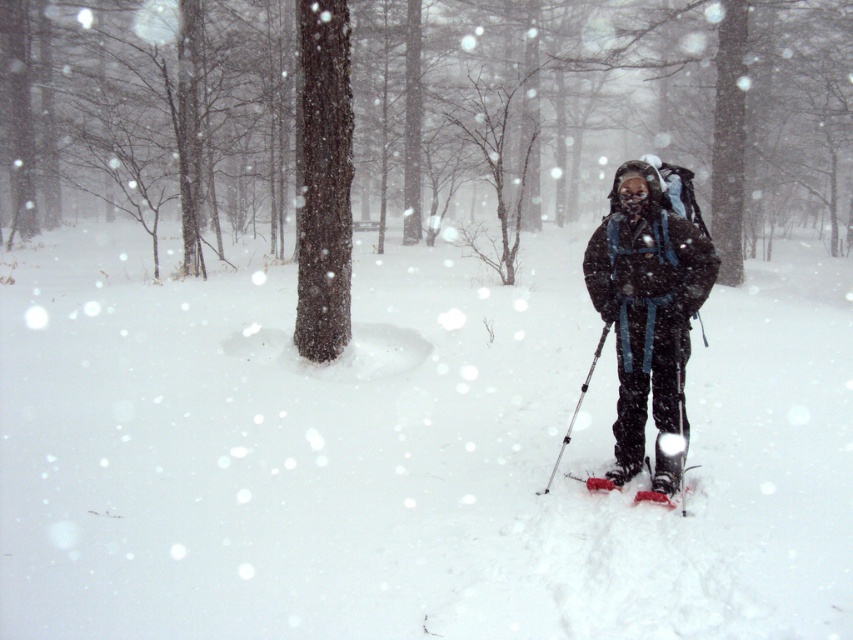
Is smooth dark brown tree trunk at center thinner than metallic silver ski pole at center?

Indeed, smooth dark brown tree trunk at center has a lesser width compared to metallic silver ski pole at center.

Does smooth dark brown tree trunk at center have a greater height compared to metallic silver ski pole at center?

Indeed, smooth dark brown tree trunk at center has a greater height compared to metallic silver ski pole at center.

You are a GUI agent. You are given a task and a screenshot of the screen. Output one action in this format:
    pyautogui.click(x=<x>, y=<y>)
    Task: Click on the smooth dark brown tree trunk at center
    Image resolution: width=853 pixels, height=640 pixels.
    Given the screenshot: What is the action you would take?
    pyautogui.click(x=323, y=179)

Does matte black jacket at center lie behind metallic silver ski pole at center?

No.

Between matte black jacket at center and metallic silver ski pole at center, which one is positioned lower?

metallic silver ski pole at center

At what (x,y) coordinates should I click in order to perform the action: click on matte black jacket at center. Please return your answer as a coordinate pair (x, y). Looking at the image, I should click on point(648,308).

Is white fluffy snow at center bigger than red plastic ski at center?

Yes.

From the picture: Which is below, white fluffy snow at center or red plastic ski at center?

red plastic ski at center

The image size is (853, 640). What do you see at coordinates (407, 452) in the screenshot? I see `white fluffy snow at center` at bounding box center [407, 452].

Find the location of a particular element. Image resolution: width=853 pixels, height=640 pixels. white fluffy snow at center is located at coordinates (407, 452).